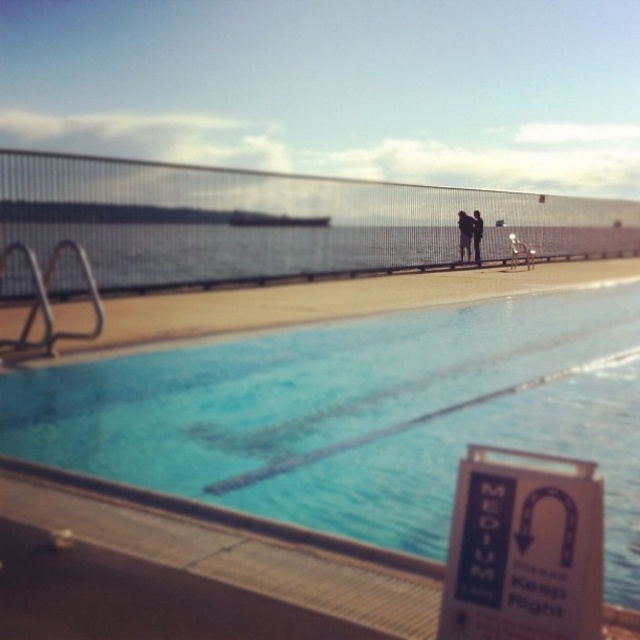
Question: Among these points, which one is farthest from the camera?

Choices:
 (A) (177, 417)
 (B) (476, 246)
 (C) (529, 252)
 (D) (474, 216)

Answer: (C)

Question: Can you confirm if blue smooth water at center is positioned to the right of black fabric person at center?

Choices:
 (A) yes
 (B) no

Answer: (B)

Question: Which object is positioned closest to the white plastic sign at lower right?

Choices:
 (A) black fabric person at center
 (B) dark blue fabric couple at center
 (C) smooth skin swimmer at center

Answer: (B)

Question: Which point appears farthest from the camera in this image?

Choices:
 (A) (532, 252)
 (B) (163, 371)
 (C) (460, 260)
 (D) (522, 550)

Answer: (A)

Question: Does smooth skin swimmer at center have a smaller size compared to black fabric person at center?

Choices:
 (A) yes
 (B) no

Answer: (B)

Question: Can you confirm if blue smooth water at center is wider than black fabric person at center?

Choices:
 (A) no
 (B) yes

Answer: (B)